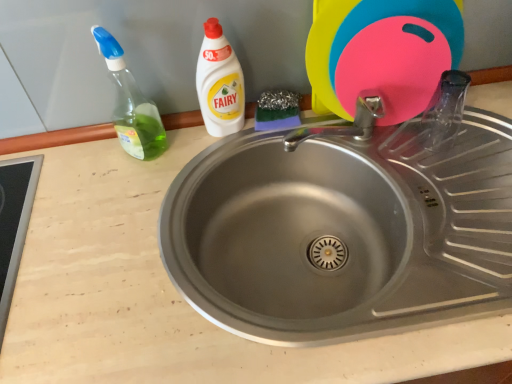
Question: Is white plastic bottle at upper center turned away from stainless steel sink at center?

Choices:
 (A) no
 (B) yes

Answer: (A)

Question: Is white plastic bottle at upper center oriented towards stainless steel sink at center?

Choices:
 (A) yes
 (B) no

Answer: (B)

Question: Considering the relative sizes of white plastic bottle at upper center and stainless steel sink at center in the image provided, is white plastic bottle at upper center thinner than stainless steel sink at center?

Choices:
 (A) no
 (B) yes

Answer: (B)

Question: Does white plastic bottle at upper center have a greater height compared to stainless steel sink at center?

Choices:
 (A) no
 (B) yes

Answer: (B)

Question: Is white plastic bottle at upper center positioned in front of stainless steel sink at center?

Choices:
 (A) no
 (B) yes

Answer: (A)

Question: Is point (117, 91) positioned closer to the camera than point (409, 89)?

Choices:
 (A) closer
 (B) farther

Answer: (B)

Question: Is green translucent bottle at left to the left or to the right of pink rubber cutting board at upper right in the image?

Choices:
 (A) right
 (B) left

Answer: (B)

Question: From the image's perspective, is green translucent bottle at left above or below pink rubber cutting board at upper right?

Choices:
 (A) below
 (B) above

Answer: (A)

Question: In terms of size, does green translucent bottle at left appear bigger or smaller than pink rubber cutting board at upper right?

Choices:
 (A) small
 (B) big

Answer: (A)

Question: From a real-world perspective, is pink rubber cutting board at upper right positioned above or below stainless steel sink at center?

Choices:
 (A) above
 (B) below

Answer: (A)

Question: Considering the positions of pink rubber cutting board at upper right and stainless steel sink at center in the image, is pink rubber cutting board at upper right wider or thinner than stainless steel sink at center?

Choices:
 (A) wide
 (B) thin

Answer: (B)

Question: Is pink rubber cutting board at upper right spatially inside stainless steel sink at center, or outside of it?

Choices:
 (A) inside
 (B) outside

Answer: (B)

Question: Relative to stainless steel sink at center, is pink rubber cutting board at upper right in front or behind?

Choices:
 (A) behind
 (B) front

Answer: (A)

Question: From a real-world perspective, is stainless steel sink at center positioned above or below white plastic bottle at upper center?

Choices:
 (A) above
 (B) below

Answer: (B)

Question: From the image's perspective, relative to white plastic bottle at upper center, is stainless steel sink at center above or below?

Choices:
 (A) below
 (B) above

Answer: (A)